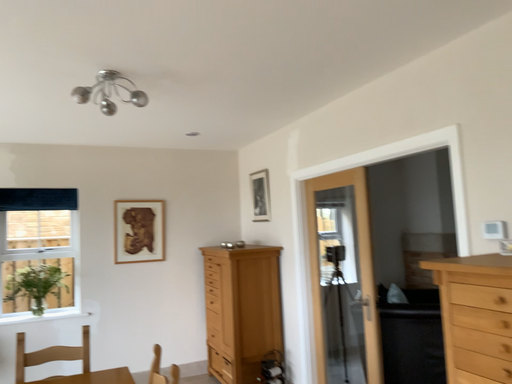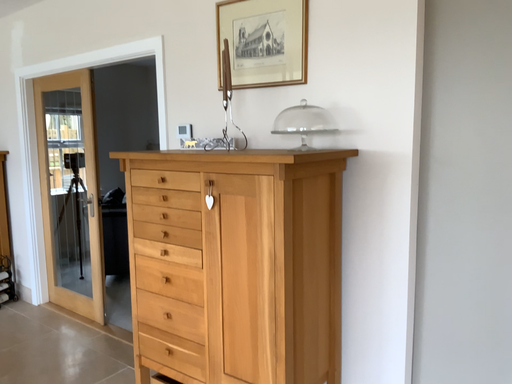
Question: Which way did the camera rotate in the video?

Choices:
 (A) rotated right
 (B) rotated left

Answer: (A)